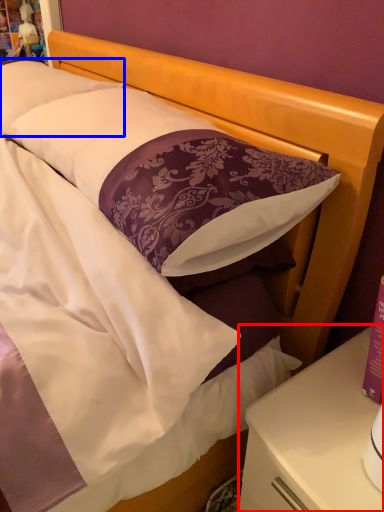
Question: Which of the following is the closest to the observer, nightstand (highlighted by a red box) or pillow (highlighted by a blue box)?

Choices:
 (A) nightstand
 (B) pillow

Answer: (A)